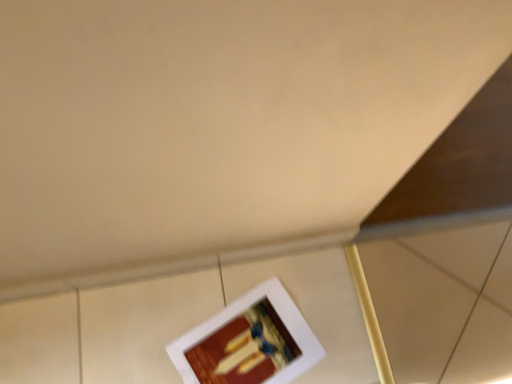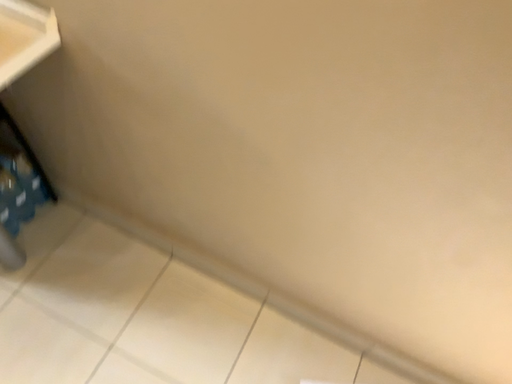
Question: How did the camera likely rotate when shooting the video?

Choices:
 (A) rotated upward
 (B) rotated downward

Answer: (A)